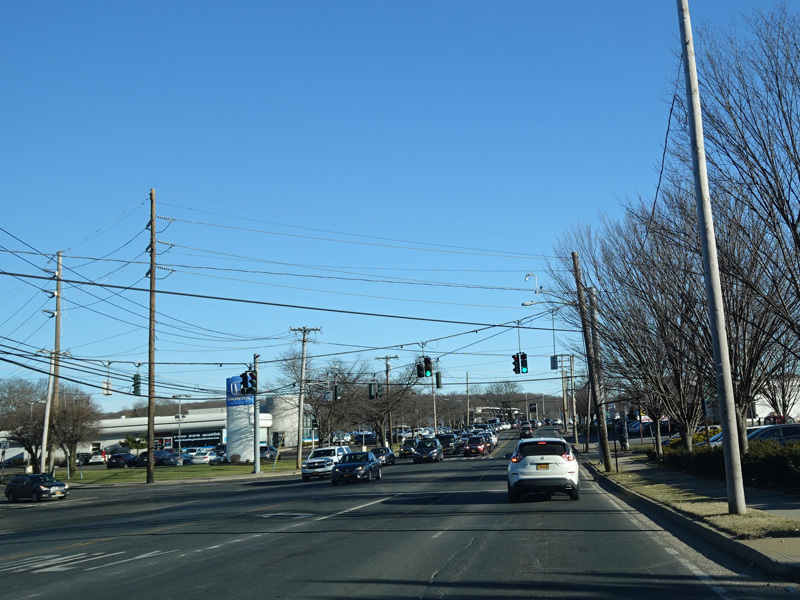
I want to click on green lights, so click(x=430, y=372), click(x=524, y=369).